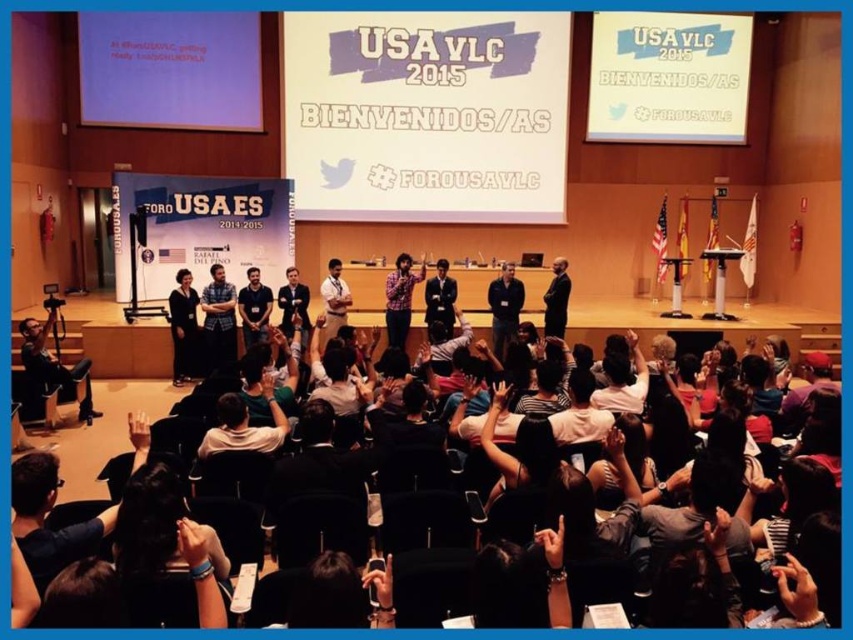
Does point (80, 412) come farther from viewer compared to point (189, 320)?

That is False.

Which of these two, matte black camera at lower left or dark gray fabric dress at center, stands shorter?

matte black camera at lower left

Identify the location of matte black camera at lower left. (53, 368).

Which is in front, point (229, 307) or point (556, 307)?

Point (229, 307) is in front.

Is matte blue shirt at center to the right of dark gray suit at center from the viewer's perspective?

In fact, matte blue shirt at center is to the left of dark gray suit at center.

Which is behind, point (207, 358) or point (555, 321)?

Positioned behind is point (555, 321).

At what (x,y) coordinates should I click in order to perform the action: click on matte blue shirt at center. Please return your answer as a coordinate pair (x, y). This screenshot has height=640, width=853. Looking at the image, I should click on (218, 320).

Can you confirm if dark blue suit at center is wider than dark gray suit at center?

Yes, dark blue suit at center is wider than dark gray suit at center.

Which is below, dark blue suit at center or dark gray suit at center?

dark blue suit at center

Which is behind, point (450, 320) or point (558, 316)?

Point (450, 320)

At what (x,y) coordinates should I click in order to perform the action: click on dark blue suit at center. Please return your answer as a coordinate pair (x, y). The width and height of the screenshot is (853, 640). Looking at the image, I should click on (440, 298).